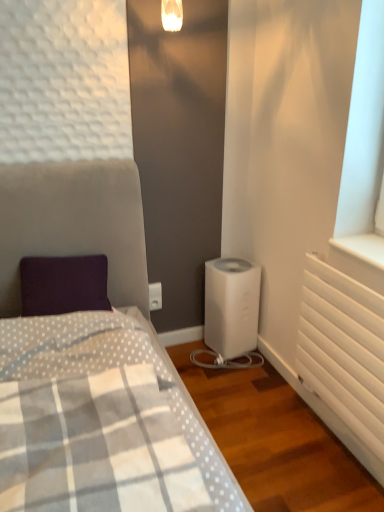
You are a GUI agent. You are given a task and a screenshot of the screen. Output one action in this format:
    pyautogui.click(x=<x>, y=<y>)
    Task: Click on the vacant space situated on the left part of white plastic water heater at lower center
    This screenshot has width=384, height=512.
    Given the screenshot: What is the action you would take?
    pyautogui.click(x=193, y=358)